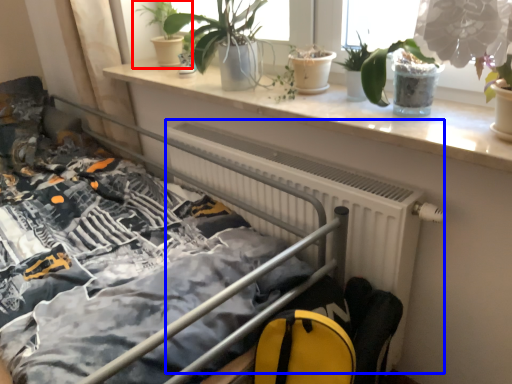
Question: Which object appears closest to the camera in this image, houseplant (highlighted by a red box) or radiator (highlighted by a blue box)?

Choices:
 (A) houseplant
 (B) radiator

Answer: (B)